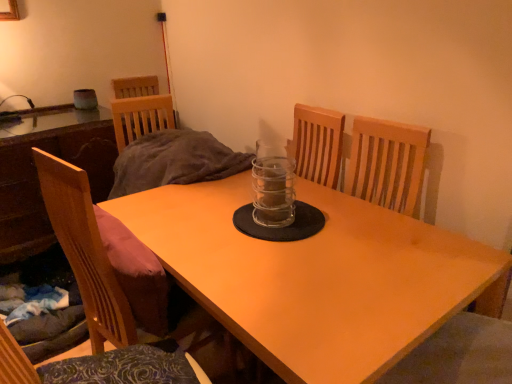
What do you see at coordinates (273, 191) in the screenshot? I see `transparent glass jar at center` at bounding box center [273, 191].

Where is `wooden table at left, the first table in the left-to-right sequence`? wooden table at left, the first table in the left-to-right sequence is located at coordinates (37, 176).

Is light brown wooden table at center, which is the second table from left to right, thinner than wooden chair at left?

Incorrect, the width of light brown wooden table at center, which is the second table from left to right, is not less than that of wooden chair at left.

Does light brown wooden table at center, the first table from the right, have a smaller size compared to wooden chair at left?

Actually, light brown wooden table at center, the first table from the right, might be larger than wooden chair at left.

Is wooden chair at left located within light brown wooden table at center, which is the second table from left to right?

That's incorrect, wooden chair at left is not inside light brown wooden table at center, which is the second table from left to right.

Which of these two, transparent glass jar at center or light brown wooden table at center, which is the second table from left to right, stands shorter?

Standing shorter between the two is transparent glass jar at center.

Visually, is transparent glass jar at center positioned to the left or to the right of light brown wooden table at center, which is the second table from left to right?

transparent glass jar at center is to the left of light brown wooden table at center, which is the second table from left to right.

Is transparent glass jar at center positioned with its back to light brown wooden table at center, the first table from the right?

No, transparent glass jar at center's orientation is not away from light brown wooden table at center, the first table from the right.

Does wooden table at left, which is the second table in right-to-left order, turn towards transparent glass jar at center?

Yes, wooden table at left, which is the second table in right-to-left order, is aimed at transparent glass jar at center.

What are the coordinates of `table above the transparent glass jar at center (from the image's perspective)` in the screenshot? It's located at (37, 176).

Is wooden table at left, the first table in the left-to-right sequence, at the left side of transparent glass jar at center?

Correct, you'll find wooden table at left, the first table in the left-to-right sequence, to the left of transparent glass jar at center.

How many degrees apart are the facing directions of transparent glass jar at center and wooden table at left, the first table in the left-to-right sequence?

88.3 degrees separate the facing orientations of transparent glass jar at center and wooden table at left, the first table in the left-to-right sequence.

Is transparent glass jar at center placed right next to wooden table at left, the first table in the left-to-right sequence?

transparent glass jar at center and wooden table at left, the first table in the left-to-right sequence, are clearly separated.

In terms of width, does transparent glass jar at center look wider or thinner when compared to wooden table at left, the first table in the left-to-right sequence?

transparent glass jar at center is thinner than wooden table at left, the first table in the left-to-right sequence.

From the image's perspective, is transparent glass jar at center above or below wooden table at left, which is the second table in right-to-left order?

transparent glass jar at center is situated lower than wooden table at left, which is the second table in right-to-left order, in the image.

Is wooden chair at left surrounding light brown wooden table at center, the first table from the right?

No.

Is wooden chair at left taller or shorter than light brown wooden table at center, the first table from the right?

wooden chair at left is shorter than light brown wooden table at center, the first table from the right.

From the image's perspective, who appears lower, wooden chair at left or light brown wooden table at center, the first table from the right?

light brown wooden table at center, the first table from the right, appears lower in the image.

Between wooden chair at left and light brown wooden table at center, which is the second table from left to right, which one has larger size?

light brown wooden table at center, which is the second table from left to right, is bigger.

In terms of size, does light brown wooden table at center, the first table from the right, appear bigger or smaller than transparent glass jar at center?

In the image, light brown wooden table at center, the first table from the right, appears to be larger than transparent glass jar at center.

Is light brown wooden table at center, the first table from the right, to the left of transparent glass jar at center from the viewer's perspective?

No.

From the picture: Who is shorter, light brown wooden table at center, the first table from the right, or transparent glass jar at center?

With less height is transparent glass jar at center.

Is light brown wooden table at center, which is the second table from left to right, not within transparent glass jar at center?

light brown wooden table at center, which is the second table from left to right, is positioned outside transparent glass jar at center.

Where is `chair that appears in front of the wooden table at left, which is the second table in right-to-left order`? The height and width of the screenshot is (384, 512). chair that appears in front of the wooden table at left, which is the second table in right-to-left order is located at coordinates (85, 251).

In the scene shown: Could you measure the distance between wooden table at left, which is the second table in right-to-left order, and wooden chair at left?

wooden table at left, which is the second table in right-to-left order, is 93.38 centimeters away from wooden chair at left.

Considering the relative sizes of wooden table at left, the first table in the left-to-right sequence, and wooden chair at left in the image provided, is wooden table at left, the first table in the left-to-right sequence, shorter than wooden chair at left?

Correct, wooden table at left, the first table in the left-to-right sequence, is not as tall as wooden chair at left.

From the image's perspective, is wooden table at left, which is the second table in right-to-left order, over wooden chair at left?

Correct, wooden table at left, which is the second table in right-to-left order, appears higher than wooden chair at left in the image.

Find the location of `table that is the 1st one when counting backward from the wooden chair at left`. table that is the 1st one when counting backward from the wooden chair at left is located at coordinates (316, 277).

I want to click on table in front of the transparent glass jar at center, so click(316, 277).

From the image, which object appears to be farther from wooden table at left, the first table in the left-to-right sequence, transparent glass jar at center or light brown wooden table at center, the first table from the right?

transparent glass jar at center lies further to wooden table at left, the first table in the left-to-right sequence, than the other object.

Based on their spatial positions, is wooden chair at left or transparent glass jar at center further from light brown wooden table at center, the first table from the right?

Based on the image, wooden chair at left appears to be further to light brown wooden table at center, the first table from the right.

Looking at this image, when comparing their distances from wooden table at left, which is the second table in right-to-left order, does wooden chair at left or light brown wooden table at center, which is the second table from left to right, seem further?

Among the two, light brown wooden table at center, which is the second table from left to right, is located further to wooden table at left, which is the second table in right-to-left order.

From the image, which object appears to be farther from wooden table at left, the first table in the left-to-right sequence, light brown wooden table at center, the first table from the right, or wooden chair at left?

light brown wooden table at center, the first table from the right.

Based on their spatial positions, is transparent glass jar at center or light brown wooden table at center, which is the second table from left to right, closer to wooden chair at left?

Among the two, light brown wooden table at center, which is the second table from left to right, is located nearer to wooden chair at left.

Considering their positions, is light brown wooden table at center, the first table from the right, positioned closer to wooden chair at left than wooden table at left, which is the second table in right-to-left order?

light brown wooden table at center, the first table from the right, is closer to wooden chair at left.

From the image, which object appears to be nearer to wooden chair at left, wooden table at left, which is the second table in right-to-left order, or light brown wooden table at center, the first table from the right?

light brown wooden table at center, the first table from the right, is positioned closer to the anchor wooden chair at left.

Estimate the real-world distances between objects in this image. Which object is closer to wooden table at left, which is the second table in right-to-left order, light brown wooden table at center, which is the second table from left to right, or transparent glass jar at center?

Among the two, light brown wooden table at center, which is the second table from left to right, is located nearer to wooden table at left, which is the second table in right-to-left order.

Locate an element on the screen. The height and width of the screenshot is (384, 512). glass jar between wooden chair at left and wooden table at left, the first table in the left-to-right sequence, from front to back is located at coordinates (273, 191).

Image resolution: width=512 pixels, height=384 pixels. Find the location of `table positioned between wooden chair at left and wooden table at left, which is the second table in right-to-left order, from near to far`. table positioned between wooden chair at left and wooden table at left, which is the second table in right-to-left order, from near to far is located at coordinates [x=316, y=277].

The width and height of the screenshot is (512, 384). I want to click on table located between wooden chair at left and transparent glass jar at center in the depth direction, so click(316, 277).

Locate an element on the screen. glass jar between wooden table at left, which is the second table in right-to-left order, and light brown wooden table at center, the first table from the right, in the horizontal direction is located at coordinates (273, 191).